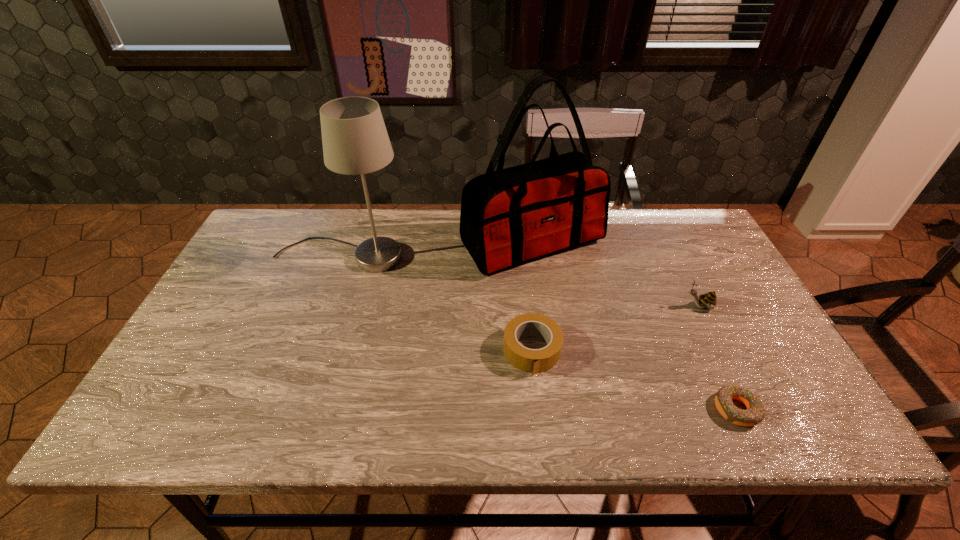
You are a GUI agent. You are given a task and a screenshot of the screen. Output one action in this format:
    pyautogui.click(x=<x>, y=<y>)
    Task: Click on the free space that is in between the snail and the second nearest object
    
    Given the screenshot: What is the action you would take?
    pyautogui.click(x=615, y=329)

At what (x,y) coordinates should I click in order to perform the action: click on empty space between the nearest object and the fourth farthest object. Please return your answer as a coordinate pair (x, y). The image size is (960, 540). Looking at the image, I should click on tap(635, 380).

The image size is (960, 540). I want to click on vacant region between the nearest object and the duffel bag, so click(x=635, y=326).

Where is `blank region between the table lamp and the duffel bag`? The width and height of the screenshot is (960, 540). blank region between the table lamp and the duffel bag is located at coordinates (437, 250).

This screenshot has width=960, height=540. I want to click on empty space between the leftmost object and the third shortest object, so [x=520, y=282].

Find the location of a particular element. free area in between the snail and the second nearest object is located at coordinates (615, 329).

Image resolution: width=960 pixels, height=540 pixels. What are the coordinates of `free point between the third farthest object and the duffel bag` in the screenshot? It's located at pyautogui.click(x=615, y=274).

Find the location of `object that is the third closest to the third shortest object`. object that is the third closest to the third shortest object is located at coordinates (534, 361).

This screenshot has height=540, width=960. What are the coordinates of `object that ranks as the fourth closest to the duffel bag` in the screenshot? It's located at (754, 414).

Locate an element on the screen. The image size is (960, 540). free region that satisfies the following two spatial constraints: 1. on the back side of the duffel bag; 2. on the left side of the table lamp is located at coordinates (347, 242).